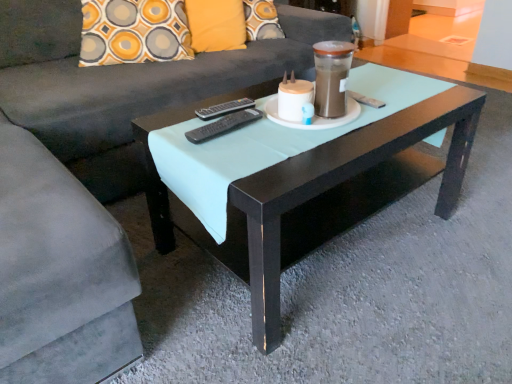
Question: Does suede gray couch at center come in front of black matte coffee table at center?

Choices:
 (A) no
 (B) yes

Answer: (B)

Question: Is suede gray couch at center oriented towards black matte coffee table at center?

Choices:
 (A) no
 (B) yes

Answer: (B)

Question: Are suede gray couch at center and black matte coffee table at center making contact?

Choices:
 (A) no
 (B) yes

Answer: (A)

Question: Does suede gray couch at center have a smaller size compared to black matte coffee table at center?

Choices:
 (A) yes
 (B) no

Answer: (B)

Question: Are suede gray couch at center and black matte coffee table at center located far from each other?

Choices:
 (A) yes
 (B) no

Answer: (B)

Question: Is black matte coffee table at center wider or thinner than suede gray couch at center?

Choices:
 (A) thin
 (B) wide

Answer: (A)

Question: Is point (153, 226) positioned closer to the camera than point (41, 380)?

Choices:
 (A) farther
 (B) closer

Answer: (A)

Question: In terms of height, does black matte coffee table at center look taller or shorter compared to suede gray couch at center?

Choices:
 (A) short
 (B) tall

Answer: (A)

Question: In terms of size, does black matte coffee table at center appear bigger or smaller than suede gray couch at center?

Choices:
 (A) small
 (B) big

Answer: (A)

Question: From the image's perspective, relative to black plastic remote at center, the second remote viewed from the front, is black plastic remote at center, which is counted as the second remote, starting from the back, above or below?

Choices:
 (A) below
 (B) above

Answer: (A)

Question: Is point (222, 125) closer or farther from the camera than point (251, 100)?

Choices:
 (A) farther
 (B) closer

Answer: (B)

Question: Is black plastic remote at center, which is counted as the second remote, starting from the back, to the left or to the right of black plastic remote at center, the 1th remote in the back-to-front sequence, in the image?

Choices:
 (A) right
 (B) left

Answer: (A)

Question: From a real-world perspective, is black plastic remote at center, which is counted as the second remote, starting from the back, positioned above or below black plastic remote at center, the 1th remote in the back-to-front sequence?

Choices:
 (A) above
 (B) below

Answer: (A)

Question: In the image, is black matte coffee table at center positioned in front of or behind black plastic remote at center, the first remote in the front-to-back sequence?

Choices:
 (A) front
 (B) behind

Answer: (A)

Question: Considering the positions of point (162, 203) and point (243, 115), is point (162, 203) closer or farther from the camera than point (243, 115)?

Choices:
 (A) closer
 (B) farther

Answer: (B)